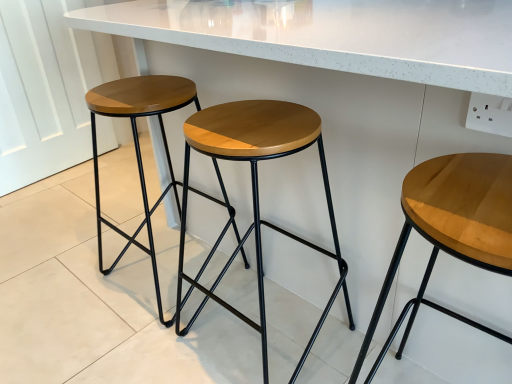
Question: Does wooden/matte stool at center, positioned as the second stool in left-to-right order, have a lesser width compared to wooden seat at center, which ranks as the 1th stool in left-to-right order?

Choices:
 (A) yes
 (B) no

Answer: (A)

Question: Could you tell me if wooden/matte stool at center, positioned as the second stool in left-to-right order, is facing wooden seat at center, which ranks as the 1th stool in left-to-right order?

Choices:
 (A) yes
 (B) no

Answer: (B)

Question: Is wooden/matte stool at center, which is counted as the 2th stool, starting from the right, in contact with wooden seat at center, which ranks as the 1th stool in left-to-right order?

Choices:
 (A) no
 (B) yes

Answer: (A)

Question: Does wooden/matte stool at center, positioned as the second stool in left-to-right order, come behind wooden seat at center, which ranks as the 1th stool in left-to-right order?

Choices:
 (A) yes
 (B) no

Answer: (B)

Question: Is wooden/matte stool at center, which is counted as the 2th stool, starting from the right, not within wooden seat at center, placed as the 3th stool when sorted from right to left?

Choices:
 (A) no
 (B) yes

Answer: (B)

Question: From the image's perspective, would you say wooden/matte stool at center, positioned as the second stool in left-to-right order, is positioned over wooden seat at center, which ranks as the 1th stool in left-to-right order?

Choices:
 (A) no
 (B) yes

Answer: (A)

Question: Is light brown wood stool at center, acting as the 1th stool starting from the right, facing away from wooden/matte stool at center, which is counted as the 2th stool, starting from the right?

Choices:
 (A) yes
 (B) no

Answer: (B)

Question: From the image's perspective, would you say light brown wood stool at center, acting as the 3th stool starting from the left, is shown under wooden/matte stool at center, positioned as the second stool in left-to-right order?

Choices:
 (A) yes
 (B) no

Answer: (A)

Question: From a real-world perspective, is light brown wood stool at center, acting as the 3th stool starting from the left, physically above wooden/matte stool at center, positioned as the second stool in left-to-right order?

Choices:
 (A) yes
 (B) no

Answer: (B)

Question: Can you see light brown wood stool at center, acting as the 1th stool starting from the right, touching wooden/matte stool at center, positioned as the second stool in left-to-right order?

Choices:
 (A) no
 (B) yes

Answer: (A)

Question: Does light brown wood stool at center, acting as the 3th stool starting from the left, have a greater width compared to wooden/matte stool at center, which is counted as the 2th stool, starting from the right?

Choices:
 (A) no
 (B) yes

Answer: (B)

Question: Is the position of light brown wood stool at center, acting as the 3th stool starting from the left, less distant than that of wooden/matte stool at center, which is counted as the 2th stool, starting from the right?

Choices:
 (A) no
 (B) yes

Answer: (B)

Question: Can you confirm if wooden seat at center, which ranks as the 1th stool in left-to-right order, is positioned to the left of light brown wood stool at center, acting as the 3th stool starting from the left?

Choices:
 (A) yes
 (B) no

Answer: (A)